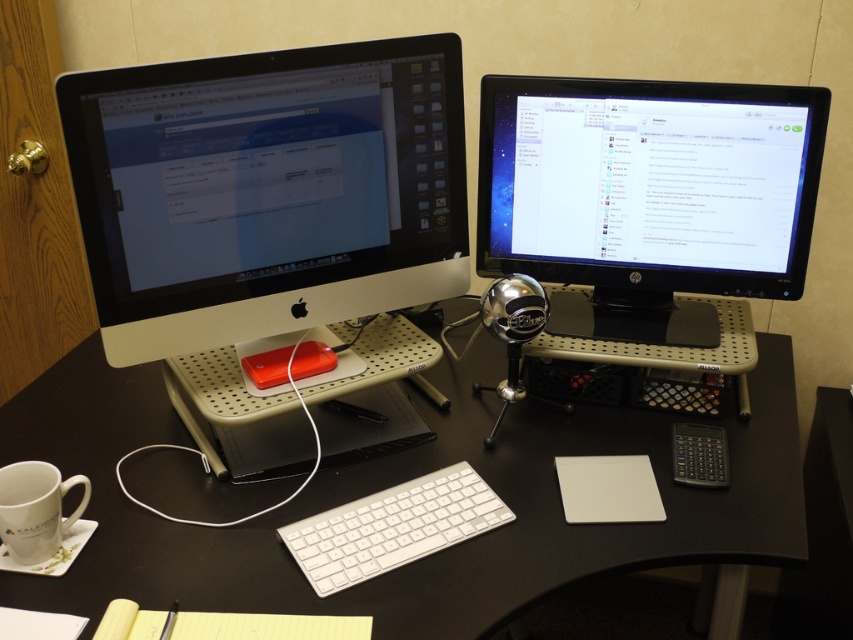
You are setting up a new desk setup and want to place a 15 cm tall paperweight on the black plastic computer desk at center. Considering the white plastic keyboard at center is already on the desk, will the paperweight fit vertically without overlapping the keyboard?

The black plastic computer desk at center is much taller than the white plastic keyboard at center, so the 15 cm tall paperweight can be placed vertically on the desk without overlapping the keyboard.

You are setting up a new monitor stand that can only hold items narrower than the white plastic keyboard at center. Can the white glossy desktop computer at left fit on the stand?

The white glossy desktop computer at left is wider than the white plastic keyboard at center, so it cannot fit on the stand since the stand can only hold items narrower than the keyboard.